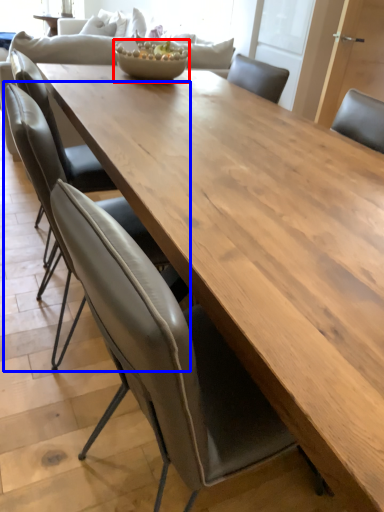
Question: Among these objects, which one is farthest to the camera, salad bowl (highlighted by a red box) or chair (highlighted by a blue box)?

Choices:
 (A) salad bowl
 (B) chair

Answer: (A)